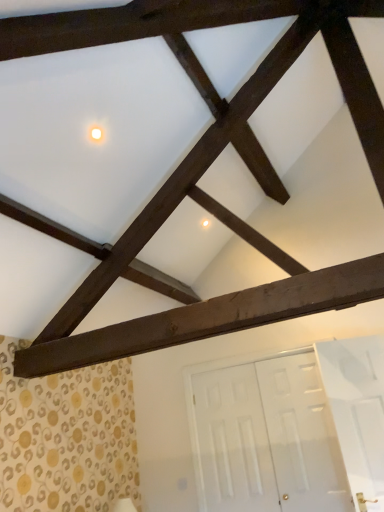
Question: Is white glossy door at lower right taller than white glossy light at upper center?

Choices:
 (A) yes
 (B) no

Answer: (A)

Question: Is white glossy door at lower right next to white glossy light at upper center?

Choices:
 (A) yes
 (B) no

Answer: (B)

Question: Does white glossy door at lower right lie in front of white glossy light at upper center?

Choices:
 (A) no
 (B) yes

Answer: (A)

Question: Is the position of white glossy door at lower right more distant than that of white glossy light at upper center?

Choices:
 (A) yes
 (B) no

Answer: (A)

Question: Is white glossy door at lower right to the left of white glossy light at upper center from the viewer's perspective?

Choices:
 (A) yes
 (B) no

Answer: (B)

Question: Relative to white glossy light at upper center, is dark brown wood at center in front or behind?

Choices:
 (A) front
 (B) behind

Answer: (A)

Question: In terms of size, does dark brown wood at center appear bigger or smaller than white glossy light at upper center?

Choices:
 (A) small
 (B) big

Answer: (B)

Question: Based on their positions, is dark brown wood at center located to the left or right of white glossy light at upper center?

Choices:
 (A) right
 (B) left

Answer: (A)

Question: Choose the correct answer: Is dark brown wood at center inside white glossy light at upper center or outside it?

Choices:
 (A) outside
 (B) inside

Answer: (A)

Question: In the image, is white glossy door at lower right on the left side or the right side of white glossy light at upper center?

Choices:
 (A) right
 (B) left

Answer: (A)

Question: From a real-world perspective, is white glossy door at lower right physically located above or below white glossy light at upper center?

Choices:
 (A) below
 (B) above

Answer: (A)

Question: In the image, is white glossy door at lower right positioned in front of or behind white glossy light at upper center?

Choices:
 (A) behind
 (B) front

Answer: (A)

Question: From the image's perspective, is white glossy door at lower right positioned above or below white glossy light at upper center?

Choices:
 (A) above
 (B) below

Answer: (B)

Question: In terms of height, does white glossy light at upper center look taller or shorter compared to dark brown wood at center?

Choices:
 (A) tall
 (B) short

Answer: (B)

Question: Relative to dark brown wood at center, is white glossy light at upper center in front or behind?

Choices:
 (A) behind
 (B) front

Answer: (A)